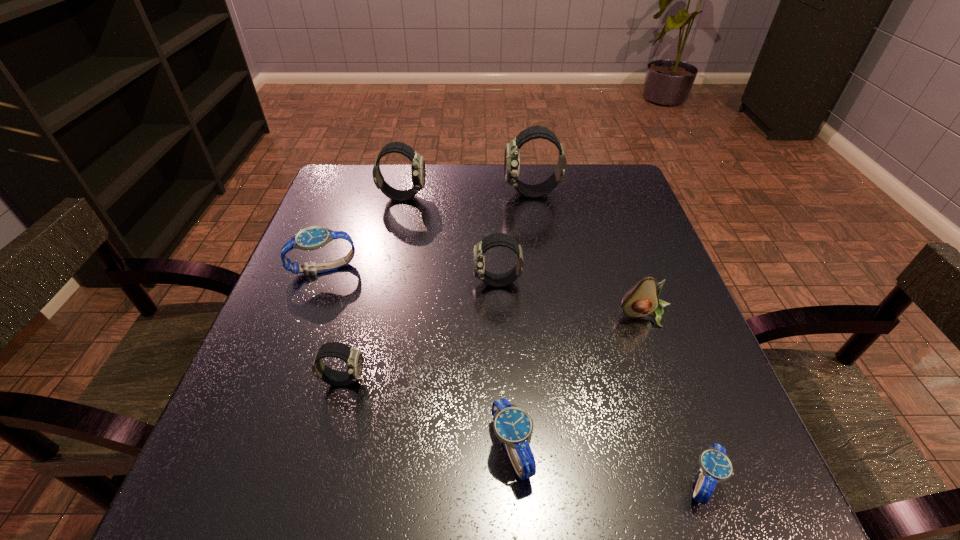
You are a GUI agent. You are given a task and a screenshot of the screen. Output one action in this format:
    pyautogui.click(x=<x>, y=<y>)
    Task: Click on the tallest watch
    This screenshot has width=960, height=540.
    Given the screenshot: What is the action you would take?
    pyautogui.click(x=512, y=151)

I want to click on the tallest object, so click(512, 151).

Where is `the second tallest object`? This screenshot has height=540, width=960. the second tallest object is located at coordinates (418, 171).

Locate an element on the screen. The image size is (960, 540). the sixth shortest watch is located at coordinates (418, 171).

I want to click on the third tallest watch, so click(x=497, y=239).

The height and width of the screenshot is (540, 960). Identify the location of the second smallest dark watch. (497, 239).

The width and height of the screenshot is (960, 540). Find the location of `avocado`. avocado is located at coordinates (641, 300).

The width and height of the screenshot is (960, 540). Identify the location of the leftmost blue watch. (311, 238).

Locate an element on the screen. the biggest blue watch is located at coordinates (311, 238).

The image size is (960, 540). In order to click on the smallest dark watch in this screenshot , I will do `click(353, 357)`.